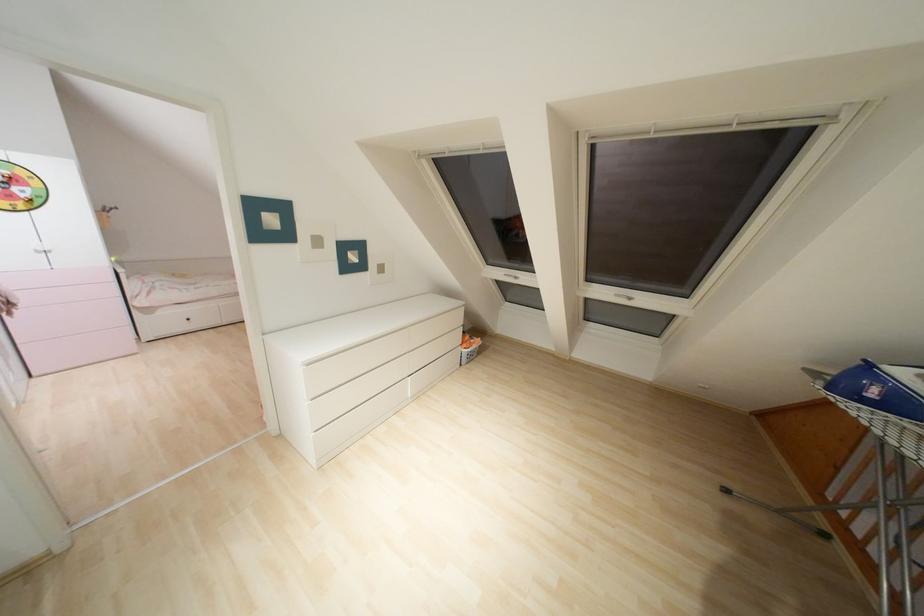
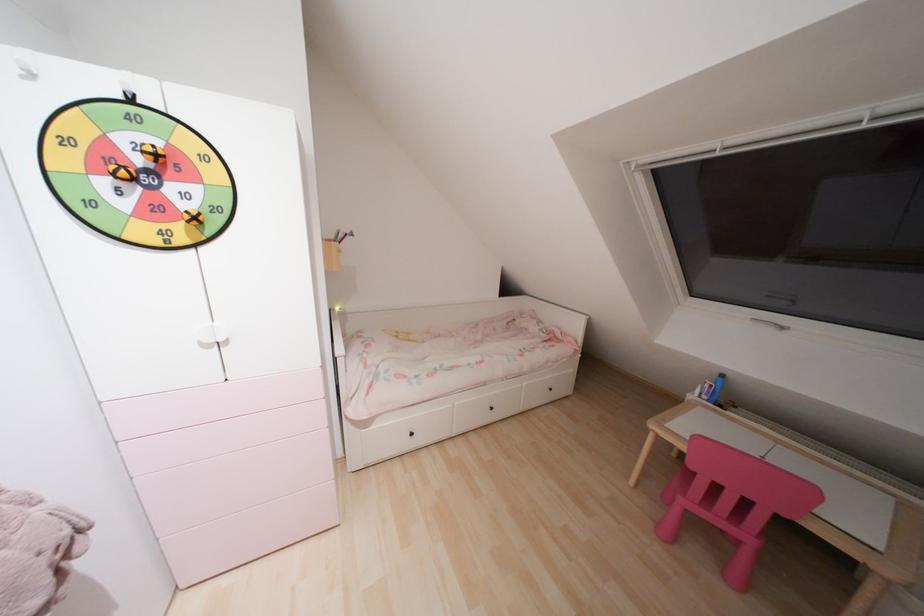
The images are taken continuously from a first-person perspective. In which direction are you moving?

Result: The cameraman moved toward left, forward.